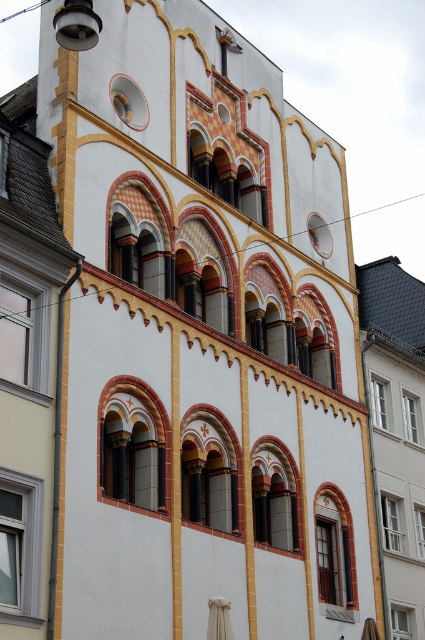
Question: Can you confirm if matte orange window at center is positioned to the left of matte white window at center?

Choices:
 (A) no
 (B) yes

Answer: (B)

Question: Can you confirm if matte yellow window at center is positioned to the right of matte glass window at lower right?

Choices:
 (A) yes
 (B) no

Answer: (B)

Question: Does matte brown window at center have a lesser width compared to matte glass window at lower right?

Choices:
 (A) no
 (B) yes

Answer: (A)

Question: Which object appears farthest from the camera in this image?

Choices:
 (A) clear glass window at lower right
 (B) matte white window at center
 (C) white glass window at center

Answer: (C)

Question: Among these objects, which one is nearest to the camera?

Choices:
 (A) clear glass window at lower right
 (B) matte orange window at center
 (C) clear glass window at center
 (D) matte brown window at center

Answer: (D)

Question: Among these points, which one is farthest from the camera?

Choices:
 (A) (422, 532)
 (B) (220, 477)
 (C) (390, 504)
 (D) (105, 483)

Answer: (A)